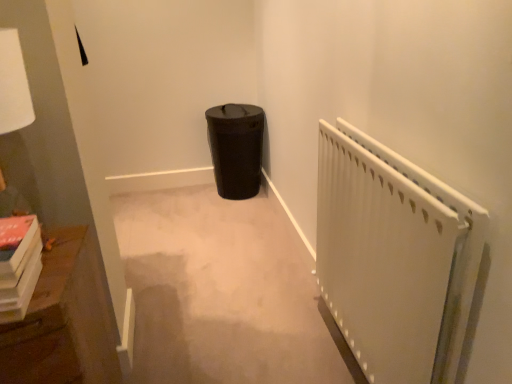
Question: From the image's perspective, is black matte trash can at center under wooden bookshelf at left?

Choices:
 (A) no
 (B) yes

Answer: (A)

Question: Does black matte trash can at center have a lesser width compared to wooden bookshelf at left?

Choices:
 (A) yes
 (B) no

Answer: (A)

Question: Considering the relative sizes of black matte trash can at center and wooden bookshelf at left in the image provided, is black matte trash can at center wider than wooden bookshelf at left?

Choices:
 (A) yes
 (B) no

Answer: (B)

Question: Is wooden bookshelf at left located within black matte trash can at center?

Choices:
 (A) no
 (B) yes

Answer: (A)

Question: Is black matte trash can at center not close to wooden bookshelf at left?

Choices:
 (A) no
 (B) yes

Answer: (B)

Question: Is wooden bookshelf at left taller or shorter than black matte trash can at center?

Choices:
 (A) short
 (B) tall

Answer: (B)

Question: In the image, is wooden bookshelf at left positioned in front of or behind black matte trash can at center?

Choices:
 (A) front
 (B) behind

Answer: (A)

Question: Is point (23, 344) positioned closer to the camera than point (254, 153)?

Choices:
 (A) farther
 (B) closer

Answer: (B)

Question: Considering the positions of wooden bookshelf at left and black matte trash can at center in the image, is wooden bookshelf at left bigger or smaller than black matte trash can at center?

Choices:
 (A) big
 (B) small

Answer: (A)

Question: In terms of width, does black matte trash can at center look wider or thinner when compared to white matte radiator at right?

Choices:
 (A) wide
 (B) thin

Answer: (A)

Question: From the image's perspective, is black matte trash can at center above or below white matte radiator at right?

Choices:
 (A) above
 (B) below

Answer: (A)

Question: From a real-world perspective, is black matte trash can at center positioned above or below white matte radiator at right?

Choices:
 (A) above
 (B) below

Answer: (B)

Question: In terms of height, does black matte trash can at center look taller or shorter compared to white matte radiator at right?

Choices:
 (A) short
 (B) tall

Answer: (A)

Question: Is point (75, 324) positioned closer to the camera than point (412, 362)?

Choices:
 (A) closer
 (B) farther

Answer: (A)

Question: From a real-world perspective, relative to white matte radiator at right, is wooden bookshelf at left vertically above or below?

Choices:
 (A) above
 (B) below

Answer: (B)